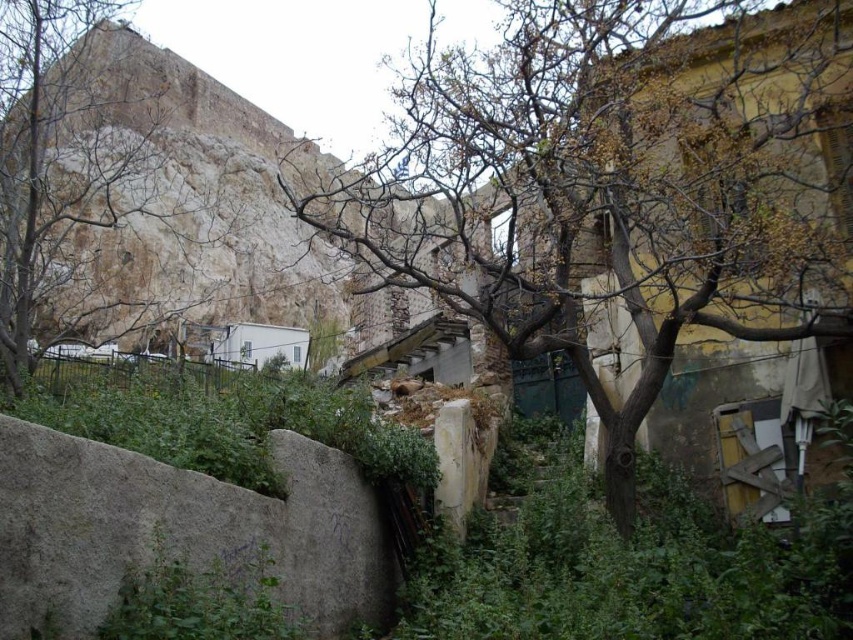
You are a city planner assessing this area for potential green space improvements. You notice the brown rough bark tree at center and the gray rough stone at lower left. Which object would require more space for maintenance equipment to maneuver around?

The brown rough bark tree at center requires more space for maintenance equipment to maneuver around because it is bigger than the gray rough stone at lower left.